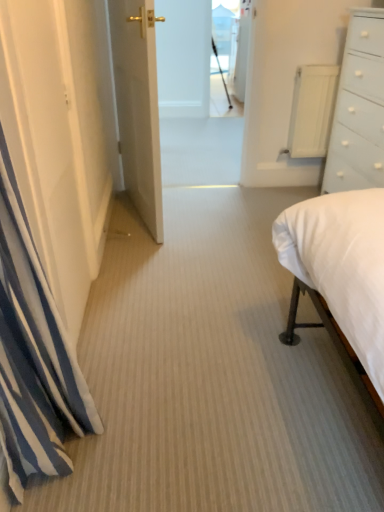
What do you see at coordinates (231, 51) in the screenshot? I see `transparent glass door at upper center` at bounding box center [231, 51].

The image size is (384, 512). What do you see at coordinates (33, 355) in the screenshot?
I see `white striped curtain at left` at bounding box center [33, 355].

The height and width of the screenshot is (512, 384). I want to click on white painted wood chest of drawers at right, so click(359, 108).

Can we say white glossy door at center lies outside transparent glass door at upper center?

That's correct, white glossy door at center is outside of transparent glass door at upper center.

Which point is more distant from viewer, (135, 38) or (218, 6)?

→ Positioned behind is point (218, 6).

This screenshot has width=384, height=512. Find the location of `door that is in front of the transparent glass door at upper center`. door that is in front of the transparent glass door at upper center is located at coordinates (138, 106).

From a real-world perspective, is white glossy door at center over transparent glass door at upper center?

No, from a real-world perspective, white glossy door at center is not above transparent glass door at upper center.

From a real-world perspective, between white glossy door at center and white painted wood chest of drawers at right, who is vertically lower?

white painted wood chest of drawers at right, from a real-world perspective.

From the image's perspective, relative to white painted wood chest of drawers at right, is white glossy door at center above or below?

Clearly, from the image's perspective, white glossy door at center is above white painted wood chest of drawers at right.

Does point (124, 164) come in front of point (364, 88)?

That is False.

Between white striped curtain at left and transparent glass door at upper center, which one has larger width?

With larger width is white striped curtain at left.

Can we say white striped curtain at left lies outside transparent glass door at upper center?

white striped curtain at left is positioned outside transparent glass door at upper center.

Is white striped curtain at left far away from transparent glass door at upper center?

Indeed, white striped curtain at left is not near transparent glass door at upper center.

Could you tell me if white striped curtain at left is facing transparent glass door at upper center?

No, white striped curtain at left does not turn towards transparent glass door at upper center.

Are transparent glass door at upper center and white striped curtain at left far apart?

Yes, transparent glass door at upper center and white striped curtain at left are located far from each other.

Identify the location of glass door above the white striped curtain at left (from the image's perspective). The image size is (384, 512). (231, 51).

Between transparent glass door at upper center and white striped curtain at left, which one has smaller width?

transparent glass door at upper center is thinner.

In the scene shown: Which object is further away from the camera taking this photo, transparent glass door at upper center or white striped curtain at left?

transparent glass door at upper center is behind.

Is white painted wood chest of drawers at right bigger or smaller than transparent glass door at upper center?

Considering their sizes, white painted wood chest of drawers at right takes up more space than transparent glass door at upper center.

Between white painted wood chest of drawers at right and transparent glass door at upper center, which one has smaller width?

With smaller width is transparent glass door at upper center.

Is white painted wood chest of drawers at right positioned before transparent glass door at upper center?

Yes, white painted wood chest of drawers at right is closer to the viewer.

How many degrees apart are the facing directions of white painted wood chest of drawers at right and transparent glass door at upper center?

The facing directions of white painted wood chest of drawers at right and transparent glass door at upper center are 87.3 degrees apart.

Is point (238, 68) in front of point (377, 42)?

No, it is behind (377, 42).

Locate an element on the screen. Image resolution: width=384 pixels, height=512 pixels. the chest of drawers that is in front of the transparent glass door at upper center is located at coordinates (359, 108).

Which is more to the right, transparent glass door at upper center or white painted wood chest of drawers at right?

From the viewer's perspective, white painted wood chest of drawers at right appears more on the right side.

Is transparent glass door at upper center not near white painted wood chest of drawers at right?

That's right, there is a large distance between transparent glass door at upper center and white painted wood chest of drawers at right.

Which is behind, transparent glass door at upper center or white glossy door at center?

transparent glass door at upper center is more distant.

Considering the relative positions of transparent glass door at upper center and white glossy door at center in the image provided, is transparent glass door at upper center to the left of white glossy door at center from the viewer's perspective?

No.

Is transparent glass door at upper center looking in the opposite direction of white glossy door at center?

transparent glass door at upper center does not have its back to white glossy door at center.

Between transparent glass door at upper center and white glossy door at center, which one has larger size?

white glossy door at center.

Where is `glass door on the right of white glossy door at center`? glass door on the right of white glossy door at center is located at coordinates (231, 51).

The height and width of the screenshot is (512, 384). Find the location of `door on the left of white painted wood chest of drawers at right`. door on the left of white painted wood chest of drawers at right is located at coordinates (138, 106).

Based on their spatial positions, is transparent glass door at upper center or white painted wood chest of drawers at right closer to white striped curtain at left?

white painted wood chest of drawers at right is closer to white striped curtain at left.

Considering their positions, is white glossy door at center positioned further to white striped curtain at left than white painted wood chest of drawers at right?

The object further to white striped curtain at left is white painted wood chest of drawers at right.

From the image, which object appears to be nearer to transparent glass door at upper center, white glossy door at center or white striped curtain at left?

Among the two, white glossy door at center is located nearer to transparent glass door at upper center.

From the image, which object appears to be nearer to white painted wood chest of drawers at right, white striped curtain at left or transparent glass door at upper center?

white striped curtain at left lies closer to white painted wood chest of drawers at right than the other object.

Based on their spatial positions, is transparent glass door at upper center or white striped curtain at left further from white painted wood chest of drawers at right?

transparent glass door at upper center.

From the picture: Which object lies nearer to the anchor point white painted wood chest of drawers at right, white glossy door at center or white striped curtain at left?

white glossy door at center lies closer to white painted wood chest of drawers at right than the other object.

Estimate the real-world distances between objects in this image. Which object is further from white glossy door at center, transparent glass door at upper center or white painted wood chest of drawers at right?

transparent glass door at upper center.

Based on their spatial positions, is transparent glass door at upper center or white glossy door at center further from white striped curtain at left?

transparent glass door at upper center is further to white striped curtain at left.

You are a GUI agent. You are given a task and a screenshot of the screen. Output one action in this format:
    pyautogui.click(x=<x>, y=<y>)
    Task: Click on the door between white striped curtain at left and white painted wood chest of drawers at right from left to right
    This screenshot has width=384, height=512.
    Given the screenshot: What is the action you would take?
    pyautogui.click(x=138, y=106)

You are a GUI agent. You are given a task and a screenshot of the screen. Output one action in this format:
    pyautogui.click(x=<x>, y=<y>)
    Task: Click on the door between white striped curtain at left and transparent glass door at upper center along the z-axis
    The width and height of the screenshot is (384, 512).
    Given the screenshot: What is the action you would take?
    pyautogui.click(x=138, y=106)

Find the location of a particular element. the chest of drawers located between white striped curtain at left and transparent glass door at upper center in the depth direction is located at coordinates pos(359,108).

In order to click on door between white painted wood chest of drawers at right and transparent glass door at upper center in the front-back direction in this screenshot , I will do `click(138, 106)`.